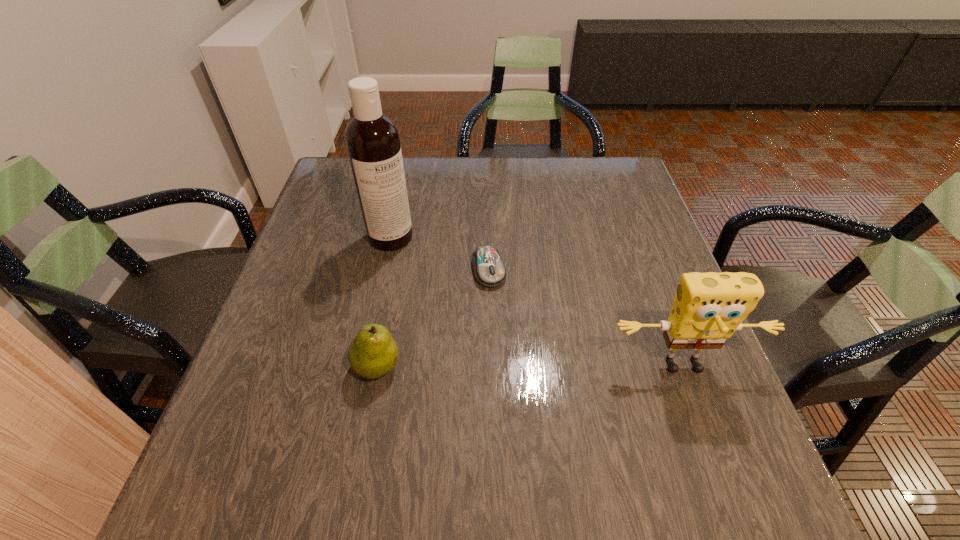
In the image, there is a desktop. At what (x,y) coordinates should I click in order to perform the action: click on vacant space at the far left corner. Please return your answer as a coordinate pair (x, y). This screenshot has width=960, height=540. Looking at the image, I should click on (348, 197).

In the image, there is a desktop. Identify the location of vacant space at the near left corner. (236, 408).

This screenshot has width=960, height=540. Identify the location of vacant space that is in between the shortest object and the pear. (433, 318).

I want to click on free spot between the farthest object and the third tallest object, so click(x=384, y=302).

The height and width of the screenshot is (540, 960). In order to click on empty space that is in between the tallest object and the rightmost object in this screenshot , I will do `click(538, 302)`.

Find the location of a particular element. This screenshot has width=960, height=540. free spot between the rightmost object and the second shortest object is located at coordinates (531, 367).

Find the location of `free area in between the sponge and the second farthest object`. free area in between the sponge and the second farthest object is located at coordinates (587, 319).

The height and width of the screenshot is (540, 960). Identify the location of blank region between the computer mouse and the pear. (433, 318).

At what (x,y) coordinates should I click in order to perform the action: click on free spot between the computer mouse and the sponge. Please return your answer as a coordinate pair (x, y). Looking at the image, I should click on (587, 319).

Where is `blank region between the second shortest object and the farthest object`? The image size is (960, 540). blank region between the second shortest object and the farthest object is located at coordinates (x=384, y=302).